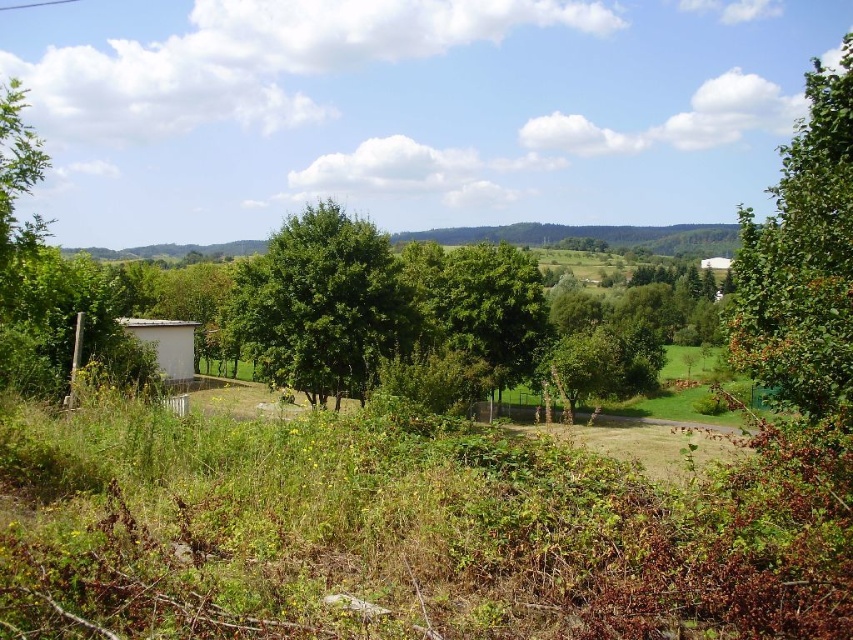
You are standing at the point with coordinates point (816,116) and want to walk to the point with coordinates point (161,365). According to the scene, will you have to walk through any objects or obstacles along the way?

Point (816,116) is in front of point (161,365), so you will have to walk through the area where the small white structure or trees are located, which may block your path.

In the scene shown: You are a hiker trying to find shelter from an unexpected rain shower. You see the green leafy tree at center and the white wood hut at lower left. Which one would provide better protection from the rain?

The white wood hut at lower left would provide better protection from the rain since it is a manmade structure designed for shelter, whereas the green leafy tree at center, despite its larger size, offers only partial cover and may not fully shield from rain.